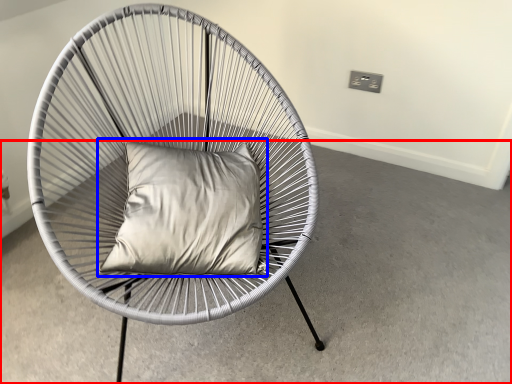
Question: Which object is closer to the camera taking this photo, concrete (highlighted by a red box) or pillow (highlighted by a blue box)?

Choices:
 (A) concrete
 (B) pillow

Answer: (A)